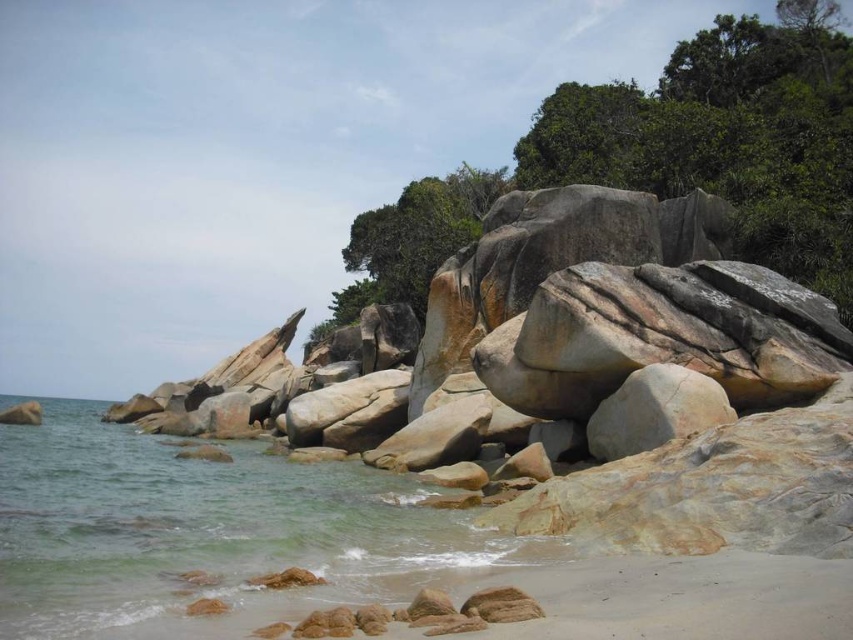
You are a photographer planning to capture the coastal scene. You want to ensure that both the clear water at lower left and the green textured tree at upper center are visible in your shot. Based on their spatial relationship, which object will occupy more of the frame?

The green textured tree at upper center occupies more space in the frame than the clear water at lower left according to the description.